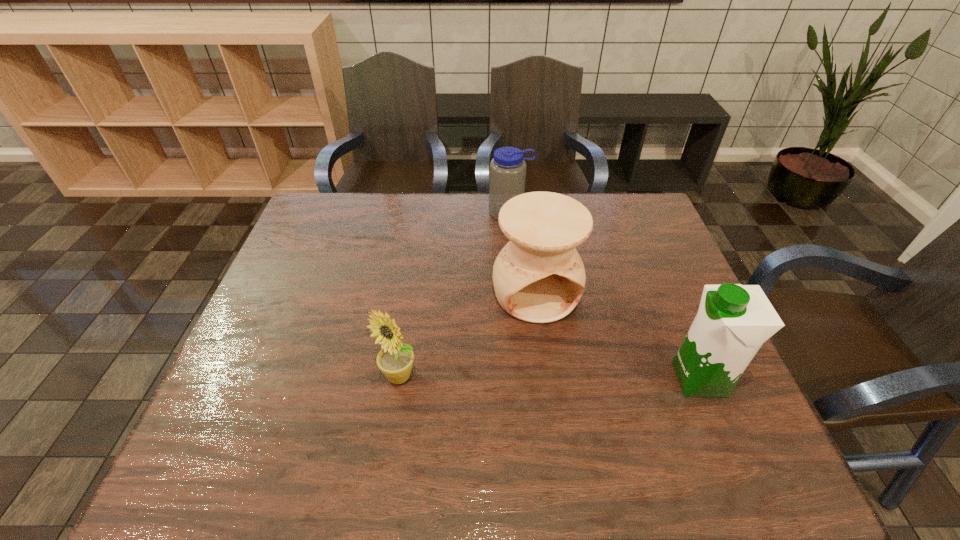
Identify the location of vacant space at the near edge of the desktop. The image size is (960, 540). (380, 398).

In the image, there is a desktop. Find the location of `vacant region at the left edge`. vacant region at the left edge is located at coordinates (323, 249).

Where is `vacant area at the right edge of the desktop`? vacant area at the right edge of the desktop is located at coordinates (639, 245).

What are the coordinates of `blank space at the near left corner of the desktop` in the screenshot? It's located at (272, 406).

Locate an element on the screen. vacant space at the far right corner of the desktop is located at coordinates (646, 233).

Where is `free spot between the leftmost object and the water bottle`? free spot between the leftmost object and the water bottle is located at coordinates (454, 295).

Find the location of a particular element. Image resolution: width=960 pixels, height=540 pixels. vacant space that is in between the soya milk and the farthest object is located at coordinates (605, 296).

Identify the location of vacant point located between the rightmost object and the sunflower. pyautogui.click(x=549, y=377).

Find the location of a particular element. The image size is (960, 540). free space between the pottery and the rightmost object is located at coordinates (618, 336).

Find the location of `free area in between the pottery and the rightmost object`. free area in between the pottery and the rightmost object is located at coordinates (618, 336).